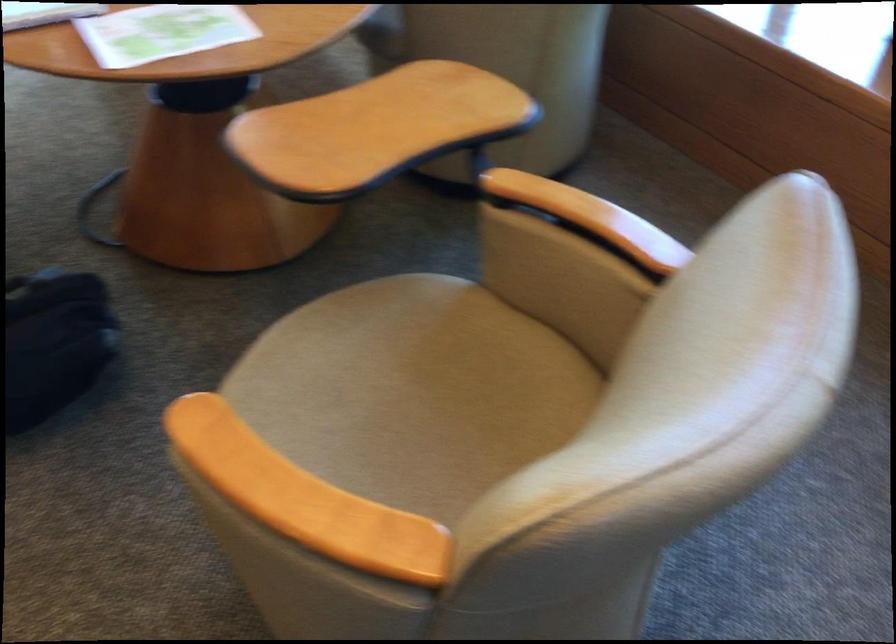
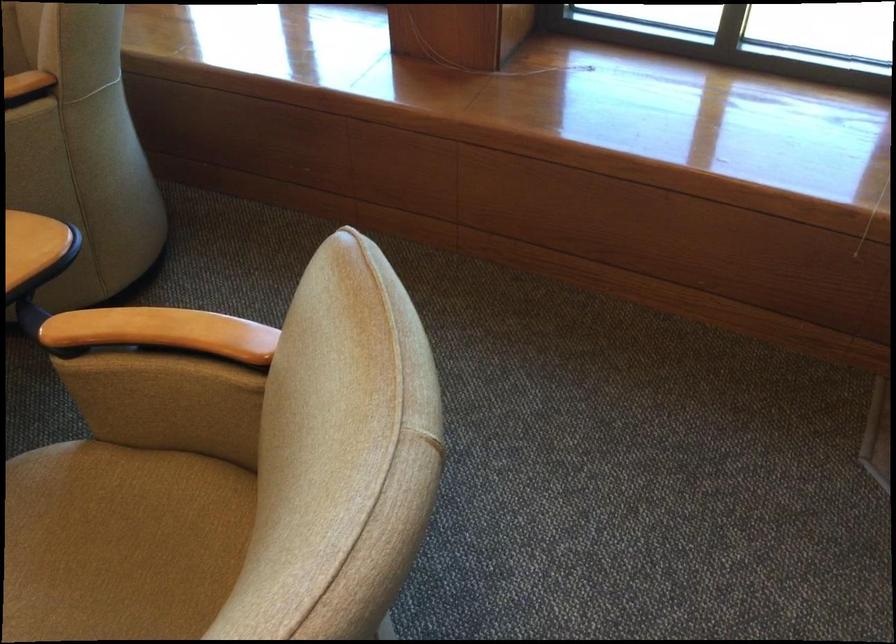
In the second image, find the point that corresponds to the point at 582,210 in the first image.

(161, 332)